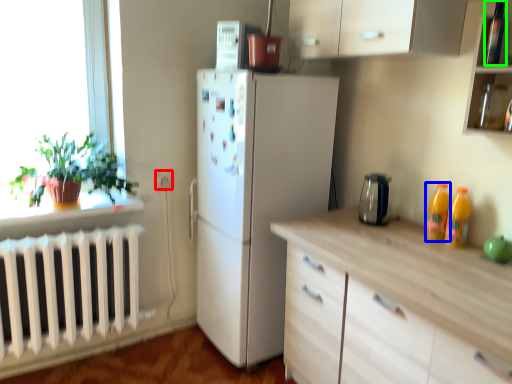
Question: Estimate the real-world distances between objects in this image. Which object is closer to electric outlet (highlighted by a red box), bottle (highlighted by a blue box) or bottle (highlighted by a green box)?

Choices:
 (A) bottle
 (B) bottle

Answer: (A)